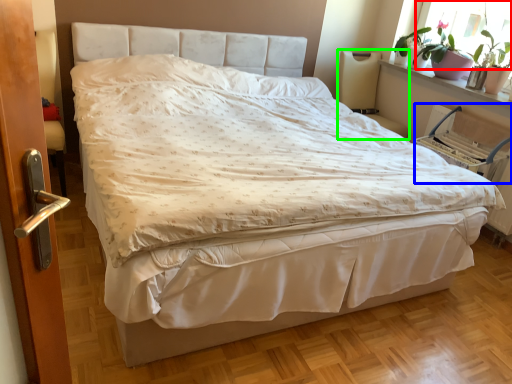
Question: Which object is the closest to the window screen (highlighted by a red box)? Choose among these: armchair (highlighted by a blue box) or armchair (highlighted by a green box).

Choices:
 (A) armchair
 (B) armchair

Answer: (A)